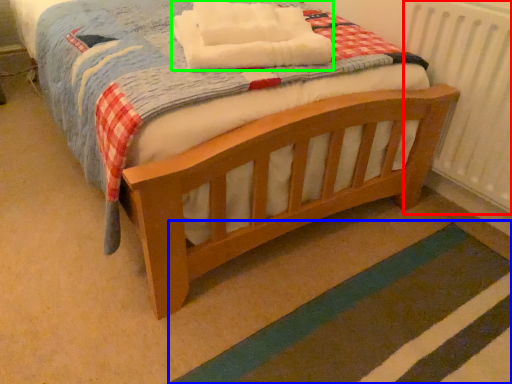
Question: Which is nearer to the radiator (highlighted by a red box)? strip (highlighted by a blue box) or blanket (highlighted by a green box).

Choices:
 (A) strip
 (B) blanket

Answer: (A)